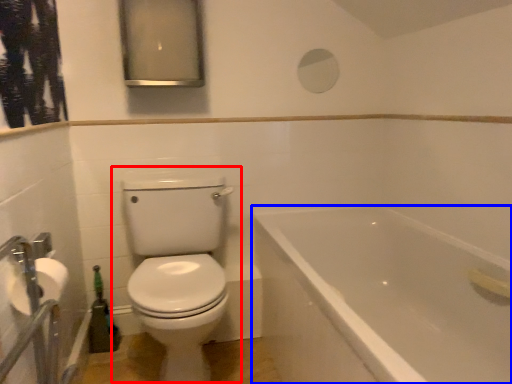
Question: Which object appears closest to the camera in this image, toilet (highlighted by a red box) or bathtub (highlighted by a blue box)?

Choices:
 (A) toilet
 (B) bathtub

Answer: (B)